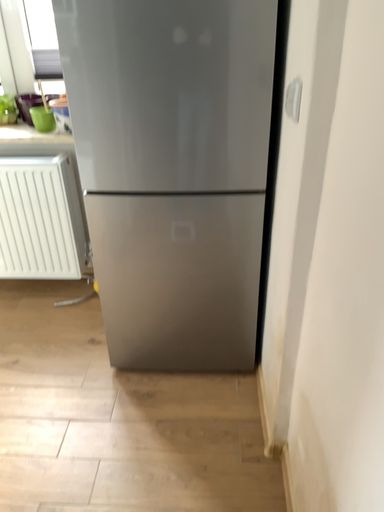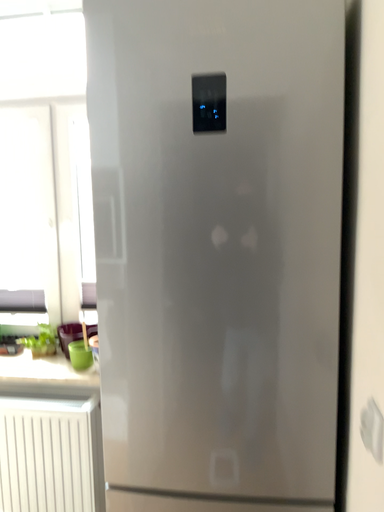
Question: How did the camera likely rotate when shooting the video?

Choices:
 (A) rotated downward
 (B) rotated upward

Answer: (B)